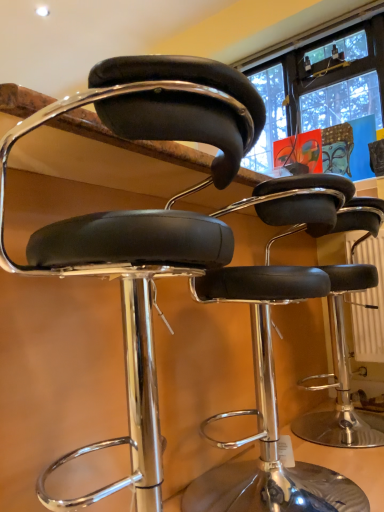
I want to click on black leather stool at center, positioned as the second chair in back-to-front order, so click(144, 224).

Image resolution: width=384 pixels, height=512 pixels. What do you see at coordinates (144, 224) in the screenshot? I see `black leather stool at center, positioned as the second chair in back-to-front order` at bounding box center [144, 224].

This screenshot has height=512, width=384. What do you see at coordinates (266, 407) in the screenshot?
I see `black leather stool at center, placed as the second chair when sorted from front to back` at bounding box center [266, 407].

The height and width of the screenshot is (512, 384). Identify the location of black leather stool at center, placed as the second chair when sorted from front to back. (266, 407).

Find the location of `black leather stool at center, the first chair in the front-to-back sequence`. black leather stool at center, the first chair in the front-to-back sequence is located at coordinates (144, 224).

Visually, is black leather stool at center, the first chair in the front-to-back sequence, positioned to the left or to the right of black leather stool at center, the 1th chair when ordered from back to front?

From the image, it's evident that black leather stool at center, the first chair in the front-to-back sequence, is to the left of black leather stool at center, the 1th chair when ordered from back to front.

Is the position of black leather stool at center, positioned as the second chair in back-to-front order, less distant than that of black leather stool at center, placed as the second chair when sorted from front to back?

Yes.

Is point (50, 234) closer or farther from the camera than point (224, 468)?

Point (50, 234) appears to be closer to the viewer than point (224, 468).

From the image's perspective, is black leather stool at center, the first chair in the front-to-back sequence, beneath black leather stool at center, placed as the second chair when sorted from front to back?

Incorrect, from the image's perspective, black leather stool at center, the first chair in the front-to-back sequence, is higher than black leather stool at center, placed as the second chair when sorted from front to back.

From a real-world perspective, which object stands above the other?

From a 3D spatial view, black leather stool at center, the first chair in the front-to-back sequence, is above.

Looking at this image, which object is wider, black leather stool at center, positioned as the second chair in back-to-front order, or black leather stool at center, placed as the second chair when sorted from front to back?

With larger width is black leather stool at center, placed as the second chair when sorted from front to back.

Considering the sizes of objects black leather stool at center, positioned as the second chair in back-to-front order, and black leather stool at center, the 1th chair when ordered from back to front, in the image provided, who is shorter, black leather stool at center, positioned as the second chair in back-to-front order, or black leather stool at center, the 1th chair when ordered from back to front,?

black leather stool at center, the 1th chair when ordered from back to front.

Between black leather stool at center, the first chair in the front-to-back sequence, and black leather stool at center, placed as the second chair when sorted from front to back, which one has smaller size?

With smaller size is black leather stool at center, placed as the second chair when sorted from front to back.

Can we say black leather stool at center, the first chair in the front-to-back sequence, lies outside black leather stool at center, the 1th chair when ordered from back to front?

black leather stool at center, the first chair in the front-to-back sequence, is positioned outside black leather stool at center, the 1th chair when ordered from back to front.

Is black leather stool at center, the first chair in the front-to-back sequence, far away from black leather stool at center, the 1th chair when ordered from back to front?

They are positioned close to each other.

Is black leather stool at center, positioned as the second chair in back-to-front order, oriented away from black leather stool at center, the 1th chair when ordered from back to front?

That's not correct — black leather stool at center, positioned as the second chair in back-to-front order, is not looking away from black leather stool at center, the 1th chair when ordered from back to front.

In the scene shown: How many degrees apart are the facing directions of black leather stool at center, the first chair in the front-to-back sequence, and black leather stool at center, placed as the second chair when sorted from front to back?

0.000178 degrees.

The image size is (384, 512). What are the coordinates of `chair above the black leather stool at center, the 1th chair when ordered from back to front (from the image's perspective)` in the screenshot? It's located at (144, 224).

Can you confirm if black leather stool at center, the 1th chair when ordered from back to front, is positioned to the left of black leather stool at center, positioned as the second chair in back-to-front order?

No, black leather stool at center, the 1th chair when ordered from back to front, is not to the left of black leather stool at center, positioned as the second chair in back-to-front order.

Is the position of black leather stool at center, placed as the second chair when sorted from front to back, less distant than that of black leather stool at center, positioned as the second chair in back-to-front order?

No, it is behind black leather stool at center, positioned as the second chair in back-to-front order.

Is point (327, 510) less distant than point (186, 255)?

That is False.

In the scene shown: From the image's perspective, who appears lower, black leather stool at center, placed as the second chair when sorted from front to back, or black leather stool at center, positioned as the second chair in back-to-front order?

black leather stool at center, placed as the second chair when sorted from front to back, appears lower in the image.

From a real-world perspective, relative to black leather stool at center, the first chair in the front-to-back sequence, is black leather stool at center, placed as the second chair when sorted from front to back, vertically above or below?

In terms of real-world spatial position, black leather stool at center, placed as the second chair when sorted from front to back, is below black leather stool at center, the first chair in the front-to-back sequence.

Considering the relative sizes of black leather stool at center, placed as the second chair when sorted from front to back, and black leather stool at center, the first chair in the front-to-back sequence, in the image provided, is black leather stool at center, placed as the second chair when sorted from front to back, thinner than black leather stool at center, the first chair in the front-to-back sequence,?

No, black leather stool at center, placed as the second chair when sorted from front to back, is not thinner than black leather stool at center, the first chair in the front-to-back sequence.

Who is taller, black leather stool at center, placed as the second chair when sorted from front to back, or black leather stool at center, the first chair in the front-to-back sequence?

black leather stool at center, the first chair in the front-to-back sequence, is taller.

Does black leather stool at center, the 1th chair when ordered from back to front, have a smaller size compared to black leather stool at center, positioned as the second chair in back-to-front order?

Indeed, black leather stool at center, the 1th chair when ordered from back to front, has a smaller size compared to black leather stool at center, positioned as the second chair in back-to-front order.

Is black leather stool at center, the 1th chair when ordered from back to front, not within black leather stool at center, positioned as the second chair in back-to-front order?

Yes, black leather stool at center, the 1th chair when ordered from back to front, is located beyond the bounds of black leather stool at center, positioned as the second chair in back-to-front order.

Is there a large distance between black leather stool at center, placed as the second chair when sorted from front to back, and black leather stool at center, the first chair in the front-to-back sequence?

They are positioned close to each other.

Could you tell me if black leather stool at center, the 1th chair when ordered from back to front, is turned towards black leather stool at center, positioned as the second chair in back-to-front order?

No.

What are the coordinates of `chair below the black leather stool at center, positioned as the second chair in back-to-front order (from the image's perspective)` in the screenshot? It's located at (266, 407).

This screenshot has width=384, height=512. I want to click on chair behind the black leather stool at center, positioned as the second chair in back-to-front order, so click(266, 407).

At what (x,y) coordinates should I click in order to perform the action: click on chair that appears above the black leather stool at center, the 1th chair when ordered from back to front (from the image's perspective). Please return your answer as a coordinate pair (x, y). Image resolution: width=384 pixels, height=512 pixels. Looking at the image, I should click on (144, 224).